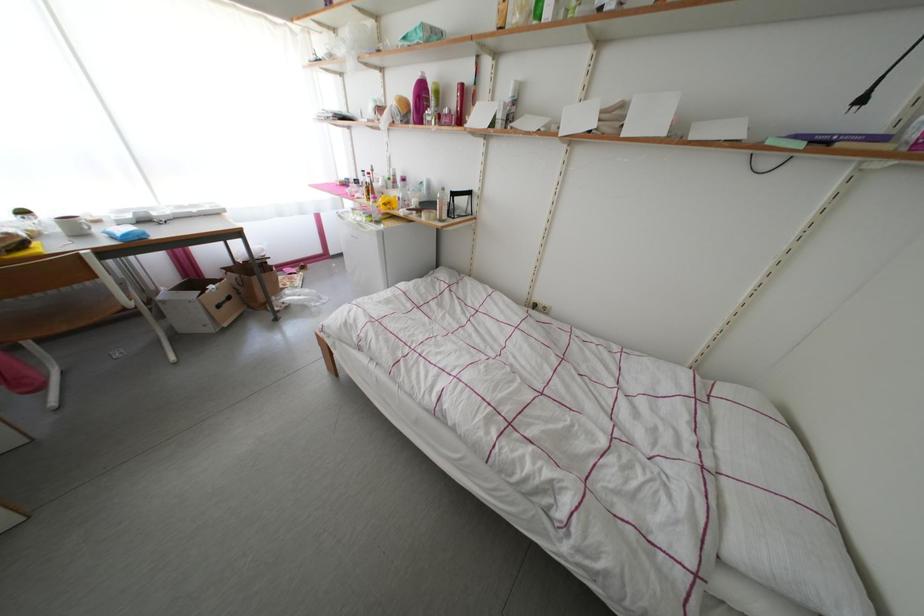
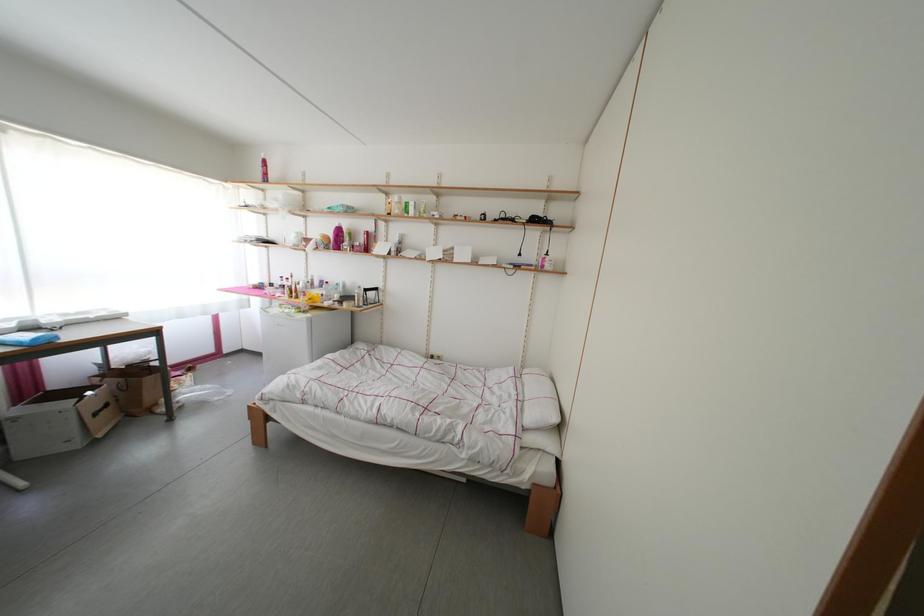
How did the camera likely rotate?

The camera's rotation is toward right-up.